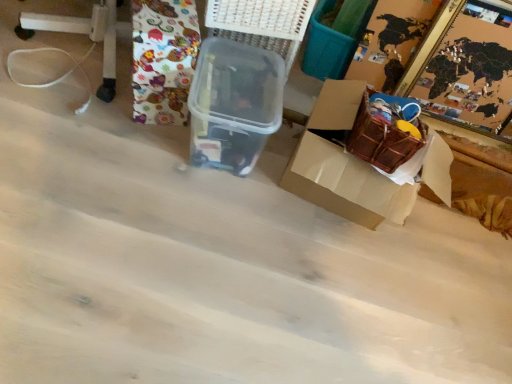
Question: Does transparent plastic container at center have a lesser width compared to wooden puzzle frame at upper right?

Choices:
 (A) no
 (B) yes

Answer: (A)

Question: Is transparent plastic container at center taller than wooden puzzle frame at upper right?

Choices:
 (A) yes
 (B) no

Answer: (B)

Question: Is transparent plastic container at center looking in the opposite direction of wooden puzzle frame at upper right?

Choices:
 (A) no
 (B) yes

Answer: (A)

Question: Can you confirm if transparent plastic container at center is wider than wooden puzzle frame at upper right?

Choices:
 (A) yes
 (B) no

Answer: (A)

Question: From the image's perspective, is transparent plastic container at center on wooden puzzle frame at upper right?

Choices:
 (A) yes
 (B) no

Answer: (B)

Question: From their relative heights in the image, would you say patterned fabric at upper left is taller or shorter than wooden puzzle frame at upper right?

Choices:
 (A) tall
 (B) short

Answer: (A)

Question: Relative to wooden puzzle frame at upper right, is patterned fabric at upper left in front or behind?

Choices:
 (A) behind
 (B) front

Answer: (B)

Question: Based on their sizes in the image, would you say patterned fabric at upper left is bigger or smaller than wooden puzzle frame at upper right?

Choices:
 (A) small
 (B) big

Answer: (A)

Question: Considering the positions of patterned fabric at upper left and wooden puzzle frame at upper right in the image, is patterned fabric at upper left wider or thinner than wooden puzzle frame at upper right?

Choices:
 (A) wide
 (B) thin

Answer: (B)

Question: Is brown cardboard box at lower right taller or shorter than wooden puzzle frame at upper right?

Choices:
 (A) short
 (B) tall

Answer: (A)

Question: From the image's perspective, relative to wooden puzzle frame at upper right, is brown cardboard box at lower right above or below?

Choices:
 (A) below
 (B) above

Answer: (A)

Question: Is point (327, 109) closer or farther from the camera than point (460, 3)?

Choices:
 (A) farther
 (B) closer

Answer: (B)

Question: From a real-world perspective, is brown cardboard box at lower right physically located above or below wooden puzzle frame at upper right?

Choices:
 (A) below
 (B) above

Answer: (B)

Question: Considering the positions of white plastic basket at upper center and patterned fabric at upper left in the image, is white plastic basket at upper center wider or thinner than patterned fabric at upper left?

Choices:
 (A) wide
 (B) thin

Answer: (B)

Question: Is white plastic basket at upper center in front of or behind patterned fabric at upper left in the image?

Choices:
 (A) front
 (B) behind

Answer: (B)